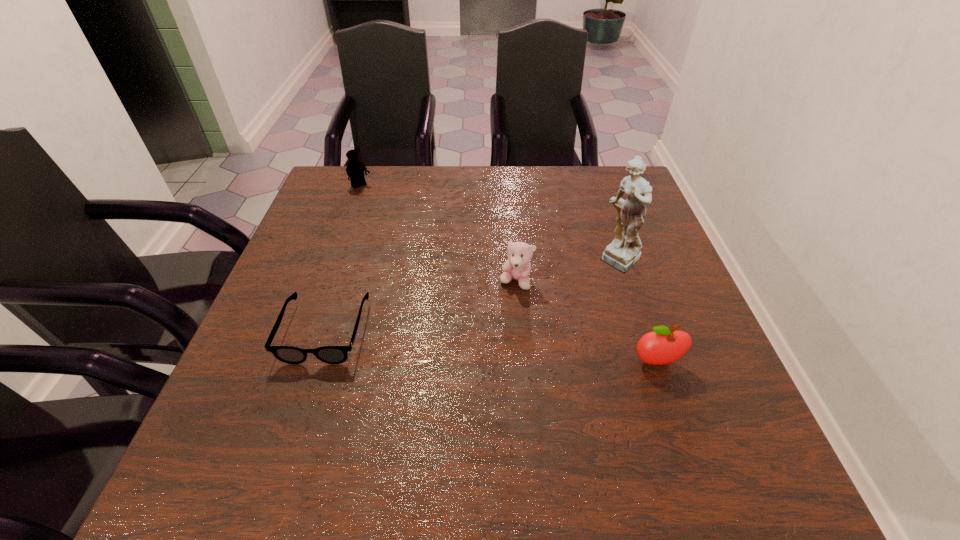
Find the location of a particular element. The width and height of the screenshot is (960, 540). the shortest object is located at coordinates (288, 354).

Image resolution: width=960 pixels, height=540 pixels. Identify the location of apple. (662, 346).

Where is `the tallest object`? The image size is (960, 540). the tallest object is located at coordinates (624, 252).

Find the location of a particular element. This screenshot has height=540, width=960. the farthest object is located at coordinates (355, 169).

The height and width of the screenshot is (540, 960). Identify the location of the third object from right to left. (518, 266).

The height and width of the screenshot is (540, 960). What are the coordinates of `free space located 0.130m on the arms of the spectacles` in the screenshot? It's located at (295, 427).

I want to click on vacant space located on the front-facing side of the apple, so click(680, 429).

Where is `free location located on the front-facing side of the figurine`? free location located on the front-facing side of the figurine is located at coordinates (585, 303).

Identify the location of free space located on the front-facing side of the figurine. (591, 295).

Image resolution: width=960 pixels, height=540 pixels. In order to click on vacant space positioned 0.090m on the front-facing side of the figurine in this screenshot , I will do click(x=591, y=295).